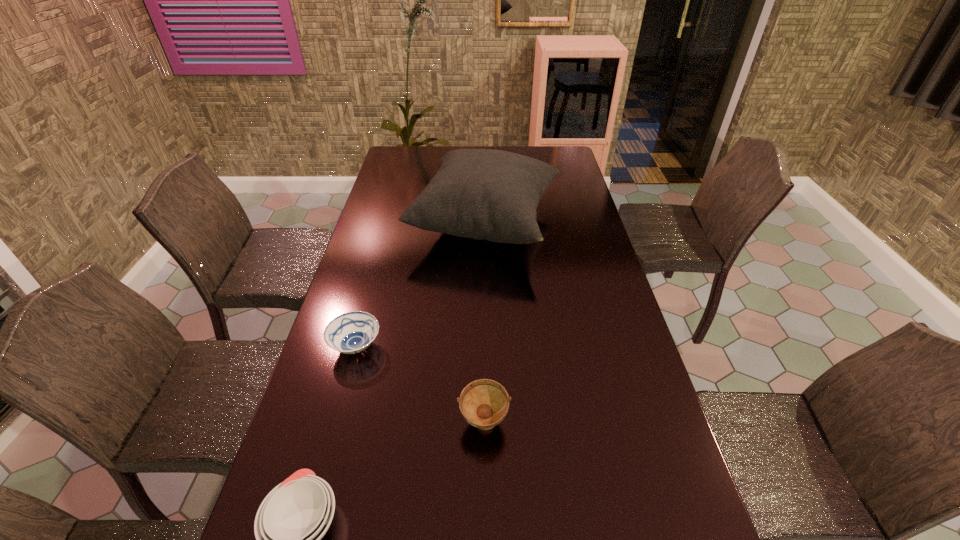
In the image, there is a desktop. At what (x,y) coordinates should I click in order to perform the action: click on vacant area at the far edge. Please return your answer as a coordinate pair (x, y). The height and width of the screenshot is (540, 960). Looking at the image, I should click on (444, 152).

In the image, there is a desktop. Where is `vacant space at the left edge`? The height and width of the screenshot is (540, 960). vacant space at the left edge is located at coordinates (368, 224).

Where is `free region at the right edge`? The width and height of the screenshot is (960, 540). free region at the right edge is located at coordinates (x=600, y=367).

Image resolution: width=960 pixels, height=540 pixels. I want to click on blank space at the far left corner of the desktop, so click(398, 154).

The width and height of the screenshot is (960, 540). I want to click on vacant area that lies between the farthest soup bowl and the rightmost soup bowl, so click(x=420, y=385).

Locate an element on the screen. The image size is (960, 540). empty space that is in between the cushion and the farthest soup bowl is located at coordinates (420, 286).

What are the coordinates of `vacant area that lies between the second farthest object and the cushion` in the screenshot? It's located at (420, 286).

Where is `vacant region between the second farthest soup bowl and the farthest soup bowl`? The width and height of the screenshot is (960, 540). vacant region between the second farthest soup bowl and the farthest soup bowl is located at coordinates (420, 385).

I want to click on empty location between the farthest object and the farthest soup bowl, so click(420, 286).

At what (x,y) coordinates should I click in order to perform the action: click on free space between the tallest soup bowl and the farthest soup bowl. Please return your answer as a coordinate pair (x, y). Looking at the image, I should click on (420, 385).